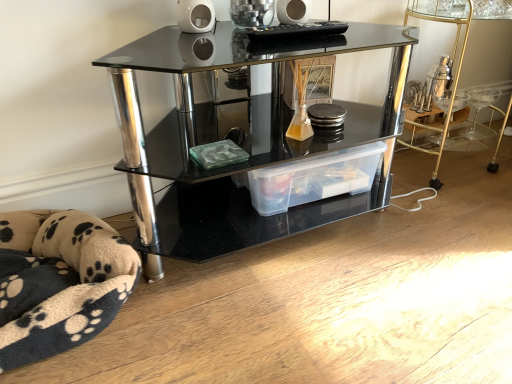
Question: Is transparent plastic storage box at center to the left or to the right of black glass shelf at center in the image?

Choices:
 (A) left
 (B) right

Answer: (B)

Question: Is point tap(263, 178) positioned closer to the camera than point tap(337, 185)?

Choices:
 (A) farther
 (B) closer

Answer: (B)

Question: Based on their relative distances, which object is nearer to the clear plastic storage container at lower right?

Choices:
 (A) beige fleece pet bed at lower left
 (B) transparent plastic storage box at center
 (C) black glass shelf at center

Answer: (B)

Question: Considering the real-world distances, which object is closest to the black glass shelf at center?

Choices:
 (A) transparent plastic storage box at center
 (B) clear plastic storage container at lower right
 (C) beige fleece pet bed at lower left

Answer: (A)